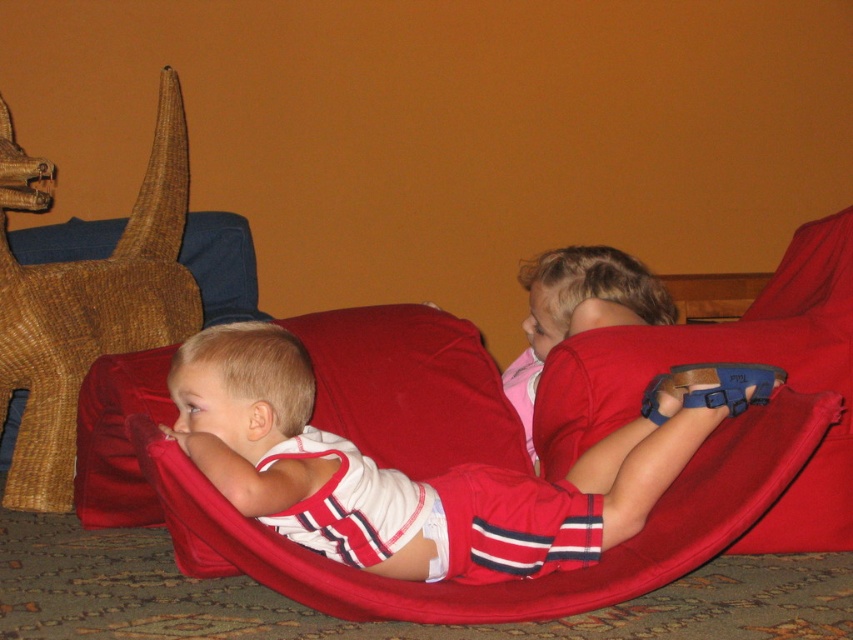
Question: Is red fabric bean bag at center thinner than pink fabric at center?

Choices:
 (A) no
 (B) yes

Answer: (A)

Question: Which object is positioned farthest from the white striped fabric at center?

Choices:
 (A) pink fabric at center
 (B) red fabric bean bag at center
 (C) woven wicker toy at left

Answer: (C)

Question: Which object is positioned farthest from the pink fabric at center?

Choices:
 (A) red fabric bean bag at center
 (B) woven wicker toy at left
 (C) white striped fabric at center

Answer: (B)

Question: Can you confirm if woven wicker toy at left is positioned above red fabric bean bag at center?

Choices:
 (A) yes
 (B) no

Answer: (A)

Question: Based on their relative distances, which object is farther from the pink fabric at center?

Choices:
 (A) white striped fabric at center
 (B) red fabric bean bag at center
 (C) woven wicker toy at left

Answer: (C)

Question: Considering the relative positions of woven wicker toy at left and red fabric bean bag at center in the image provided, where is woven wicker toy at left located with respect to red fabric bean bag at center?

Choices:
 (A) below
 (B) above

Answer: (B)